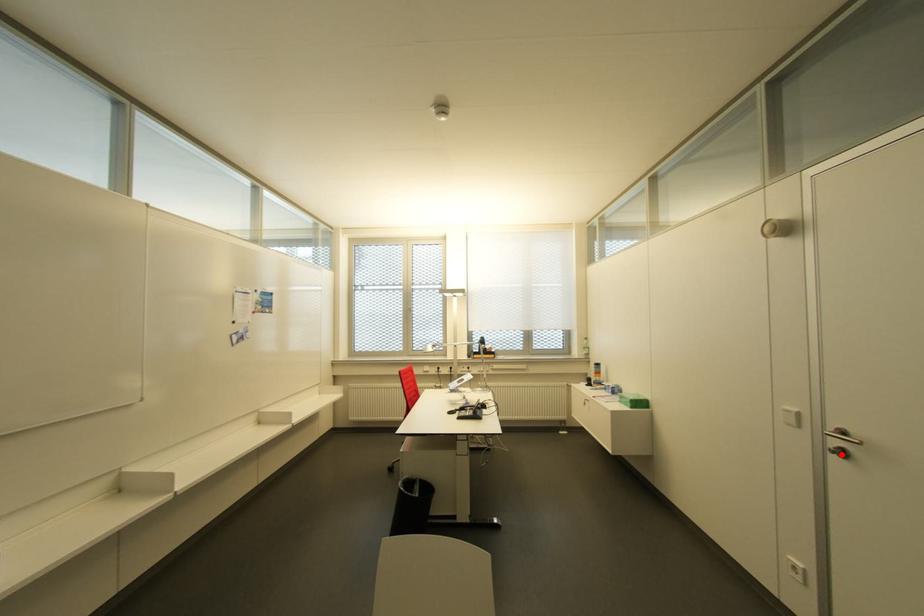
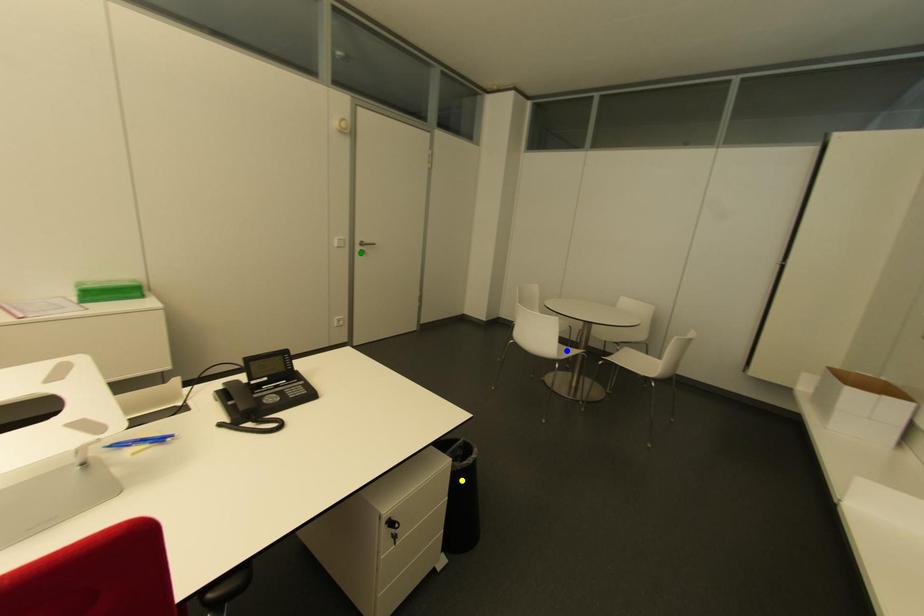
Question: I am providing you with two images of the same scene from different viewpoints. A red point is marked on the first image. You are given multiple points on the second image. Which spot in image 2 lines up with the point in image 1?

Choices:
 (A) green point
 (B) blue point
 (C) yellow point

Answer: (A)